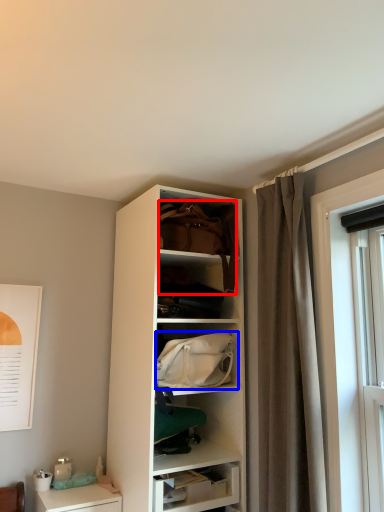
Question: Which point is closer to the camera, handbag (highlighted by a red box) or handbag (highlighted by a blue box)?

Choices:
 (A) handbag
 (B) handbag

Answer: (B)